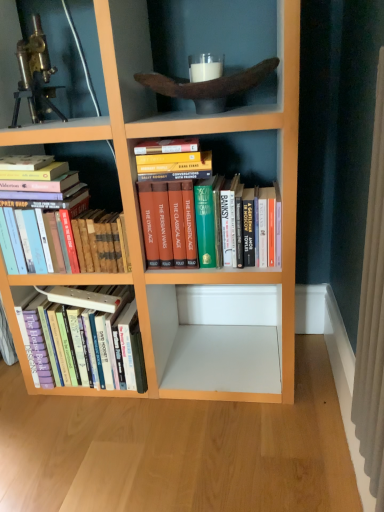
You are a GUI agent. You are given a task and a screenshot of the screen. Output one action in this format:
    pyautogui.click(x=<x>, y=<y>)
    Task: Click on the brass metallic telescope at upper left
    This screenshot has height=512, width=384.
    Given the screenshot: What is the action you would take?
    tap(35, 77)

The height and width of the screenshot is (512, 384). What do you see at coordinates (84, 337) in the screenshot? I see `hardcover books at left, the 1th book ordered from the bottom` at bounding box center [84, 337].

The image size is (384, 512). What are the coordinates of `hardcover books at left, which is the second book in top-to-bottom order` in the screenshot? It's located at (65, 223).

At what (x,y) coordinates should I click in order to perform the action: click on hardcover books at center, which is the third book in bottom-to-top order. Please return your answer as a coordinate pair (x, y). The height and width of the screenshot is (512, 384). Looking at the image, I should click on (176, 212).

Where is `brass metallic telescope at upper left`? The height and width of the screenshot is (512, 384). brass metallic telescope at upper left is located at coordinates (35, 77).

From the image's perspective, which object appears higher, hardcover books at left, the 1th book ordered from the bottom, or hardcover books at left, which is the second book in top-to-bottom order?

hardcover books at left, which is the second book in top-to-bottom order, appears higher in the image.

From the picture: From a real-world perspective, is hardcover books at left, the third book from the top, over hardcover books at left, which is the second book in top-to-bottom order?

No, from a real-world perspective, hardcover books at left, the third book from the top, is not on top of hardcover books at left, which is the second book in top-to-bottom order.

Which point is more forward, (58, 298) or (70, 174)?

The point (70, 174) is closer to the camera.

Can you confirm if hardcover books at left, which is the second book in top-to-bottom order, is thinner than hardcover books at center, which is the 1th book from top to bottom?

Yes.

How different are the orientations of hardcover books at left, the second book in the bottom-to-top sequence, and hardcover books at center, which is the 1th book from top to bottom, in degrees?

The facing directions of hardcover books at left, the second book in the bottom-to-top sequence, and hardcover books at center, which is the 1th book from top to bottom, are 3.2 degrees apart.

Consider the image. Is hardcover books at left, which is the second book in top-to-bottom order, inside the boundaries of hardcover books at center, which is the 1th book from top to bottom, or outside?

The correct answer is: outside.

Looking at this image, is hardcover books at left, the second book in the bottom-to-top sequence, oriented away from hardcover books at center, which is the third book in bottom-to-top order?

No, hardcover books at left, the second book in the bottom-to-top sequence,'s orientation is not away from hardcover books at center, which is the third book in bottom-to-top order.

Is point (59, 345) positioned before point (56, 110)?

Yes, it is in front of point (56, 110).

Is hardcover books at left, the third book from the top, to the left of brass metallic telescope at upper left from the viewer's perspective?

No.

Is hardcover books at left, the 1th book ordered from the bottom, located outside brass metallic telescope at upper left?

Absolutely, hardcover books at left, the 1th book ordered from the bottom, is external to brass metallic telescope at upper left.

Is hardcover books at left, the third book from the top, taller or shorter than brass metallic telescope at upper left?

Clearly, hardcover books at left, the third book from the top, is taller compared to brass metallic telescope at upper left.

Is point (196, 202) closer or farther from the camera than point (20, 71)?

Point (196, 202) is closer to the camera than point (20, 71).

Find the location of a particular element. telescope above the hardcover books at center, which is the third book in bottom-to-top order (from a real-world perspective) is located at coordinates (35, 77).

Is the depth of hardcover books at center, which is the 1th book from top to bottom, greater than that of brass metallic telescope at upper left?

No, hardcover books at center, which is the 1th book from top to bottom, is closer to the camera.

From a real-world perspective, which object stands above the other?

From a 3D spatial view, brass metallic telescope at upper left is above.

Considering the sizes of objects brass metallic telescope at upper left and hardcover books at left, the 1th book ordered from the bottom, in the image provided, who is wider, brass metallic telescope at upper left or hardcover books at left, the 1th book ordered from the bottom,?

With larger width is hardcover books at left, the 1th book ordered from the bottom.

The width and height of the screenshot is (384, 512). I want to click on telescope that is above the hardcover books at left, the 1th book ordered from the bottom (from a real-world perspective), so click(35, 77).

Are brass metallic telescope at upper left and hardcover books at left, the 1th book ordered from the bottom, beside each other?

brass metallic telescope at upper left and hardcover books at left, the 1th book ordered from the bottom, are clearly separated.

In the scene shown: Is hardcover books at left, the 1th book ordered from the bottom, at the back of brass metallic telescope at upper left?

No, hardcover books at left, the 1th book ordered from the bottom, is not at the back of brass metallic telescope at upper left.

Can you confirm if hardcover books at center, which is the third book in bottom-to-top order, is positioned to the left of hardcover books at left, which is the second book in top-to-bottom order?

No.

Based on the photo, considering the relative sizes of hardcover books at center, which is the third book in bottom-to-top order, and hardcover books at left, which is the second book in top-to-bottom order, in the image provided, is hardcover books at center, which is the third book in bottom-to-top order, wider than hardcover books at left, which is the second book in top-to-bottom order,?

Correct, the width of hardcover books at center, which is the third book in bottom-to-top order, exceeds that of hardcover books at left, which is the second book in top-to-bottom order.

Choose the correct answer: Is hardcover books at center, which is the third book in bottom-to-top order, inside hardcover books at left, the second book in the bottom-to-top sequence, or outside it?

hardcover books at center, which is the third book in bottom-to-top order, is not inside hardcover books at left, the second book in the bottom-to-top sequence, it's outside.

Considering the positions of point (143, 213) and point (48, 213), is point (143, 213) closer or farther from the camera than point (48, 213)?

Point (143, 213).

Would you say hardcover books at left, the third book from the top, contains hardcover books at center, which is the 1th book from top to bottom?

Definitely not — hardcover books at center, which is the 1th book from top to bottom, is not inside hardcover books at left, the third book from the top.

Considering the positions of objects hardcover books at left, the third book from the top, and hardcover books at center, which is the 1th book from top to bottom, in the image provided, who is behind, hardcover books at left, the third book from the top, or hardcover books at center, which is the 1th book from top to bottom,?

Positioned behind is hardcover books at left, the third book from the top.

Is hardcover books at left, the 1th book ordered from the bottom, facing away from hardcover books at center, which is the third book in bottom-to-top order?

No, hardcover books at left, the 1th book ordered from the bottom,'s orientation is not away from hardcover books at center, which is the third book in bottom-to-top order.

In order to click on book to the left of hardcover books at left, the 1th book ordered from the bottom in this screenshot , I will do `click(65, 223)`.

Locate an element on the screen. The image size is (384, 512). book that appears above the hardcover books at left, which is the second book in top-to-bottom order (from a real-world perspective) is located at coordinates (176, 212).

Considering their positions, is hardcover books at left, the third book from the top, positioned closer to brass metallic telescope at upper left than hardcover books at center, which is the third book in bottom-to-top order?

hardcover books at center, which is the third book in bottom-to-top order, lies closer to brass metallic telescope at upper left than the other object.

Which object lies further to the anchor point hardcover books at center, which is the third book in bottom-to-top order, hardcover books at left, which is the second book in top-to-bottom order, or brass metallic telescope at upper left?

The object further to hardcover books at center, which is the third book in bottom-to-top order, is brass metallic telescope at upper left.

Looking at the image, which one is located closer to hardcover books at left, the second book in the bottom-to-top sequence, hardcover books at left, the third book from the top, or hardcover books at center, which is the third book in bottom-to-top order?

hardcover books at center, which is the third book in bottom-to-top order, is positioned closer to the anchor hardcover books at left, the second book in the bottom-to-top sequence.

Looking at the image, which one is located closer to brass metallic telescope at upper left, hardcover books at left, the 1th book ordered from the bottom, or hardcover books at left, the second book in the bottom-to-top sequence?

hardcover books at left, the second book in the bottom-to-top sequence, is closer to brass metallic telescope at upper left.

Estimate the real-world distances between objects in this image. Which object is further from hardcover books at left, the 1th book ordered from the bottom, brass metallic telescope at upper left or hardcover books at center, which is the 1th book from top to bottom?

brass metallic telescope at upper left lies further to hardcover books at left, the 1th book ordered from the bottom, than the other object.

Based on their spatial positions, is brass metallic telescope at upper left or hardcover books at left, which is the second book in top-to-bottom order, further from hardcover books at center, which is the 1th book from top to bottom?

brass metallic telescope at upper left.

From the image, which object appears to be farther from hardcover books at left, which is the second book in top-to-bottom order, hardcover books at left, the third book from the top, or brass metallic telescope at upper left?

brass metallic telescope at upper left lies further to hardcover books at left, which is the second book in top-to-bottom order, than the other object.

Looking at the image, which one is located closer to hardcover books at center, which is the third book in bottom-to-top order, hardcover books at left, the second book in the bottom-to-top sequence, or hardcover books at left, the 1th book ordered from the bottom?

Based on the image, hardcover books at left, the second book in the bottom-to-top sequence, appears to be nearer to hardcover books at center, which is the third book in bottom-to-top order.

Find the location of a particular element. This screenshot has height=512, width=384. book situated between hardcover books at left, the second book in the bottom-to-top sequence, and hardcover books at center, which is the third book in bottom-to-top order, from left to right is located at coordinates (84, 337).